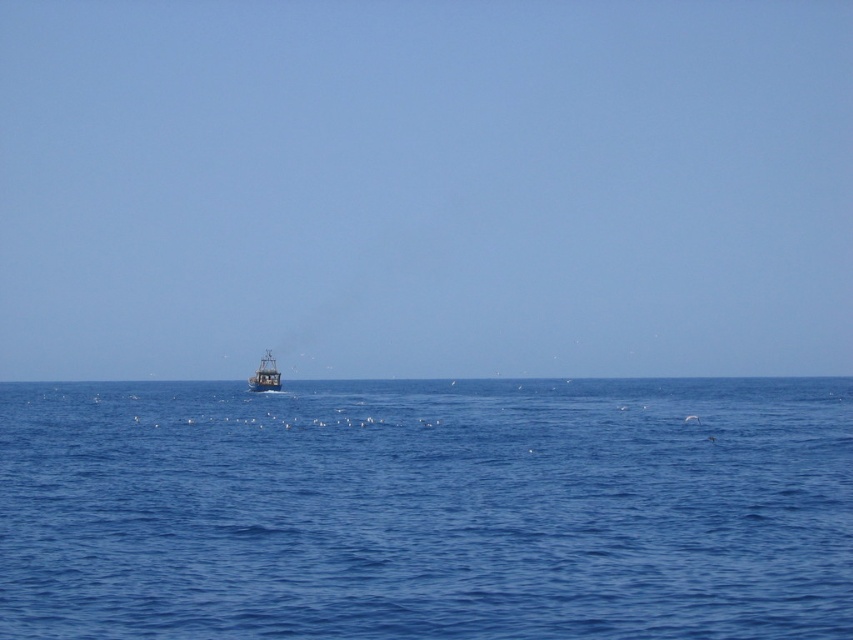
Between blue liquid water at center and metallic gray boat at center, which one appears on the left side from the viewer's perspective?

metallic gray boat at center

Is point (48, 468) less distant than point (276, 385)?

Yes, point (48, 468) is in front of point (276, 385).

You are a GUI agent. You are given a task and a screenshot of the screen. Output one action in this format:
    pyautogui.click(x=<x>, y=<y>)
    Task: Click on the blue liquid water at center
    This screenshot has height=640, width=853.
    Given the screenshot: What is the action you would take?
    pyautogui.click(x=427, y=509)

Locate an element on the screen. The height and width of the screenshot is (640, 853). blue liquid water at center is located at coordinates (427, 509).